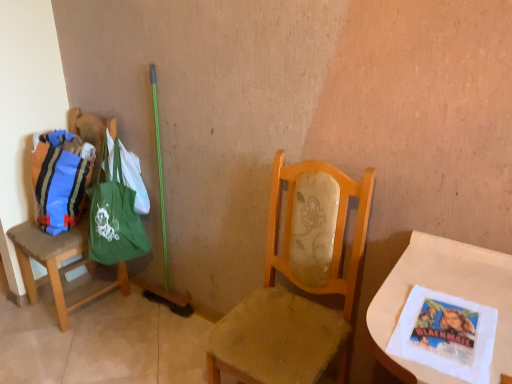
Question: From a real-world perspective, is matte blue fabric bag at left physically located above or below white paper napkin at lower right?

Choices:
 (A) below
 (B) above

Answer: (A)

Question: Based on their positions, is matte blue fabric bag at left located to the left or right of white paper napkin at lower right?

Choices:
 (A) left
 (B) right

Answer: (A)

Question: Considering the real-world distances, which object is farthest from the white paper napkin at lower right?

Choices:
 (A) wooden chair at center, which is counted as the 1th chair, starting from the front
 (B) green fabric bag at left, which is the 1th chair in left-to-right order
 (C) matte blue fabric bag at left
 (D) green canvas tote at left

Answer: (B)

Question: Estimate the real-world distances between objects in this image. Which object is farther from the green canvas tote at left?

Choices:
 (A) matte blue fabric bag at left
 (B) white paper napkin at lower right
 (C) green fabric bag at left, the 2th chair when ordered from front to back
 (D) wooden chair at center, arranged as the first chair when viewed from the right

Answer: (B)